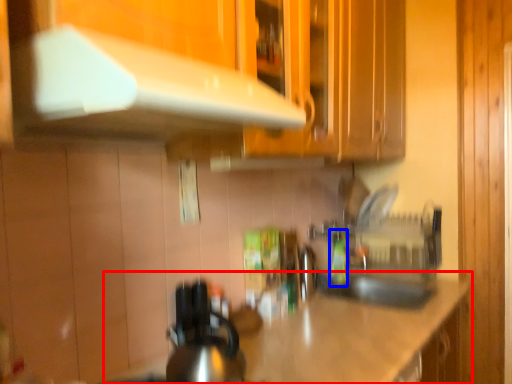
Question: Among these objects, which one is farthest to the camera, countertop (highlighted by a red box) or bottle (highlighted by a blue box)?

Choices:
 (A) countertop
 (B) bottle

Answer: (B)